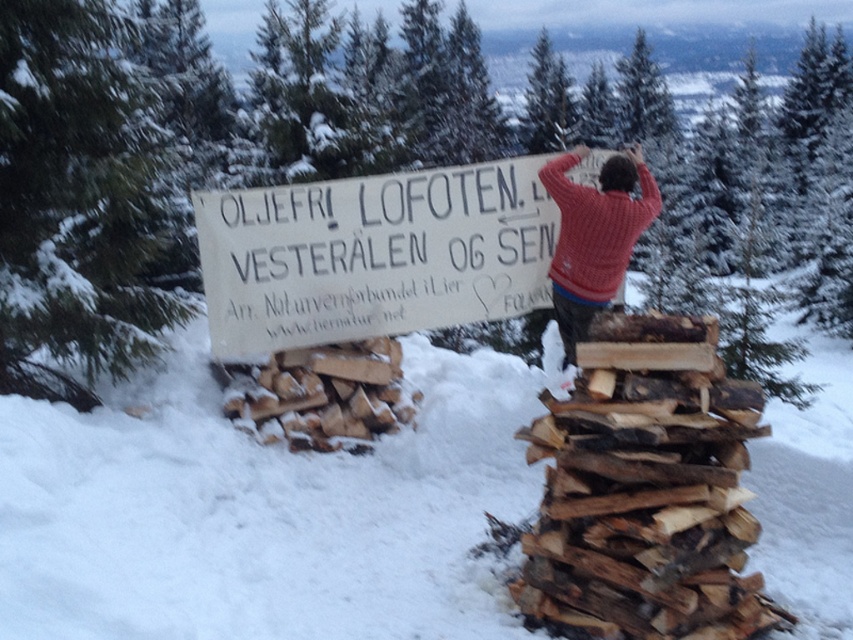
Who is more forward, (235,243) or (650,193)?

Point (235,243) is in front.

The height and width of the screenshot is (640, 853). In order to click on white paper sign at center in this screenshot , I will do `click(373, 256)`.

Does white powdery snow at center lie in front of knitted wool sweater at upper right?

Yes, white powdery snow at center is closer to the viewer.

Is white powdery snow at center shorter than knitted wool sweater at upper right?

Yes, white powdery snow at center is shorter than knitted wool sweater at upper right.

The height and width of the screenshot is (640, 853). I want to click on white powdery snow at center, so click(x=262, y=513).

Who is positioned more to the right, green textured pine at upper left or natural wood at right?

Positioned to the right is natural wood at right.

Find the location of `green textured pine at upper left`. green textured pine at upper left is located at coordinates (221, 148).